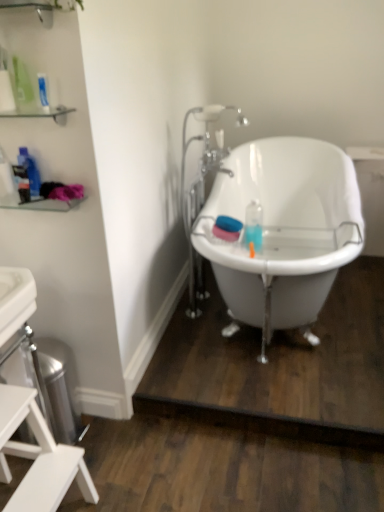
Question: In terms of width, does translucent plastic bottle at left, placed as the second bottle when sorted from right to left, look wider or thinner when compared to white glossy bathtub at center?

Choices:
 (A) thin
 (B) wide

Answer: (A)

Question: Considering the positions of translucent plastic bottle at left, which appears as the 1th bottle when viewed from the left, and white glossy bathtub at center in the image, is translucent plastic bottle at left, which appears as the 1th bottle when viewed from the left, taller or shorter than white glossy bathtub at center?

Choices:
 (A) tall
 (B) short

Answer: (B)

Question: Which object is the farthest from the white matte stool at lower left?

Choices:
 (A) clear glass shelf at upper left
 (B) white glossy bathtub at center
 (C) translucent plastic bottle at left, placed as the second bottle when sorted from right to left
 (D) chrome metallic faucet at center
 (E) translucent plastic bottle at upper left, marked as the 2th bottle in a left-to-right arrangement

Answer: (D)

Question: Which object is the closest to the white matte stool at lower left?

Choices:
 (A) blue matte mouthwash at center
 (B) translucent plastic bottle at upper left, the first bottle viewed from the right
 (C) clear glass shelf at upper left
 (D) chrome metallic faucet at center
 (E) white glossy bathtub at center

Answer: (B)